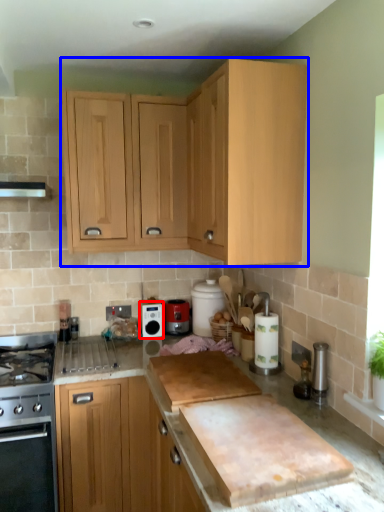
Question: Among these objects, which one is farthest to the camera, kitchen appliance (highlighted by a red box) or cabinetry (highlighted by a blue box)?

Choices:
 (A) kitchen appliance
 (B) cabinetry

Answer: (A)